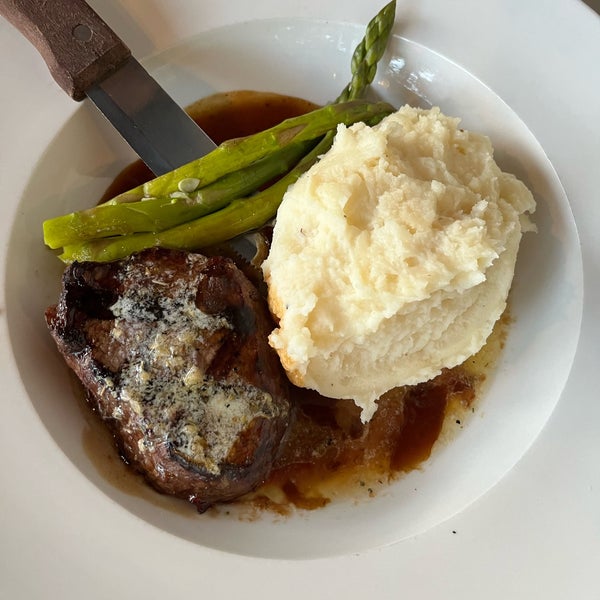
Identify the location of white background, countertop. The width and height of the screenshot is (600, 600). (60, 557).